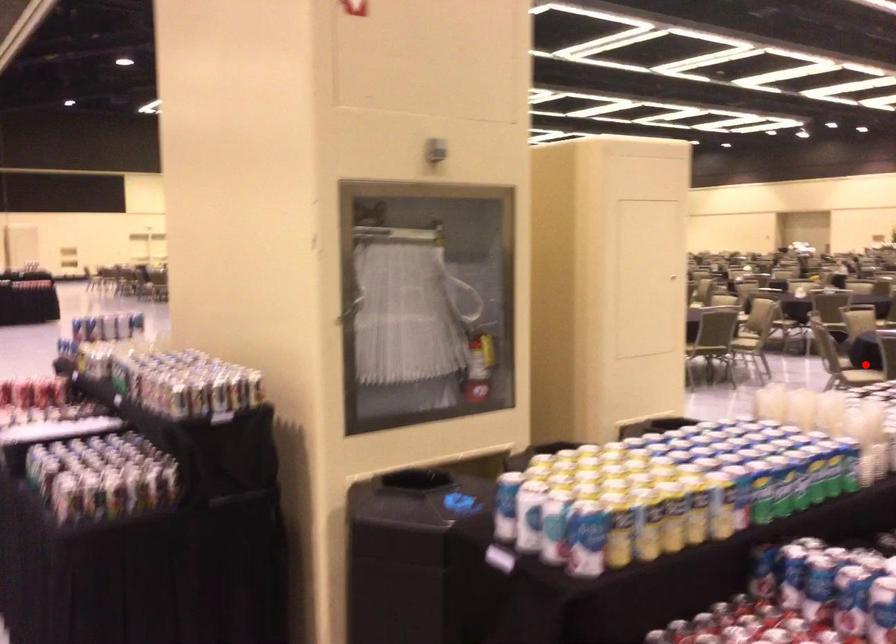
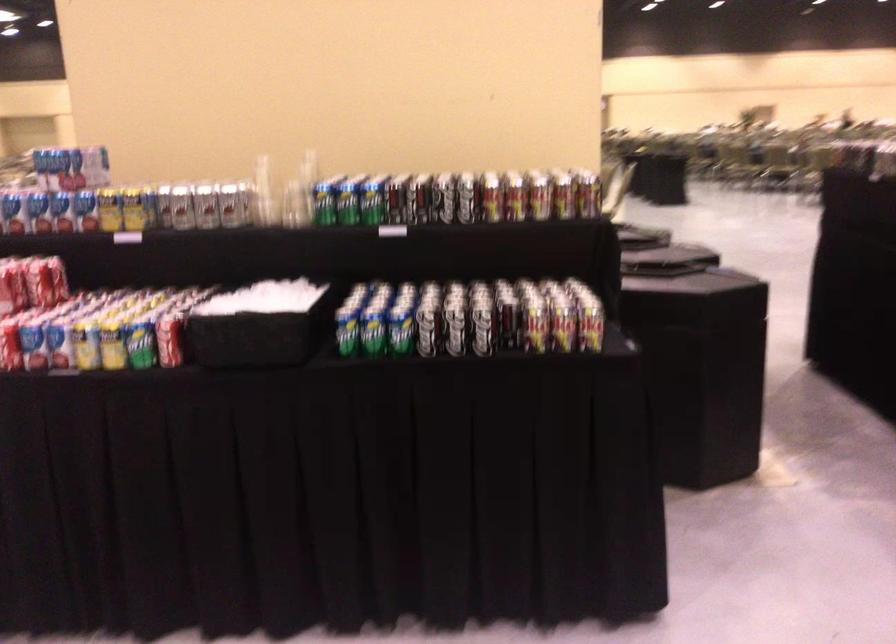
Question: I am providing you with two images of the same scene from different viewpoints. A red point is marked on the first image. At the location where the point appears in image 1, is it still visible in image 2?

Choices:
 (A) Yes
 (B) No

Answer: (B)